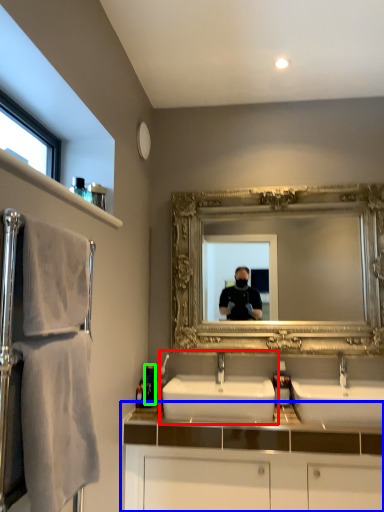
Question: Which object is the farthest from sink (highlighted by a red box)? Choose among these: bathroom cabinet (highlighted by a blue box) or toiletry (highlighted by a green box).

Choices:
 (A) bathroom cabinet
 (B) toiletry

Answer: (B)